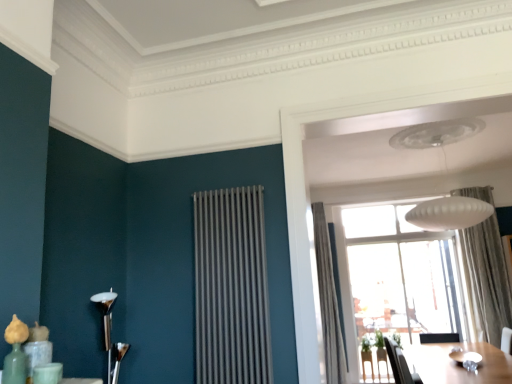
Question: Does gray textured curtain at upper right, positioned as the second curtain in right-to-left order, have a lesser height compared to white matte lampshade at upper center, acting as the 1th lamp starting from the back?

Choices:
 (A) no
 (B) yes

Answer: (A)

Question: Is gray textured curtain at upper right, positioned as the 1th curtain in left-to-right order, at the right side of white matte lampshade at upper center, the 1th lamp from the top?

Choices:
 (A) no
 (B) yes

Answer: (A)

Question: From a real-world perspective, is gray textured curtain at upper right, positioned as the second curtain in right-to-left order, on white matte lampshade at upper center, the 1th lamp from the top?

Choices:
 (A) yes
 (B) no

Answer: (B)

Question: Can you confirm if gray textured curtain at upper right, positioned as the 1th curtain in left-to-right order, is bigger than white matte lampshade at upper center, the 1th lamp from the top?

Choices:
 (A) yes
 (B) no

Answer: (B)

Question: Does gray textured curtain at upper right, positioned as the second curtain in right-to-left order, have a greater width compared to white matte lampshade at upper center, the 2th lamp in the front-to-back sequence?

Choices:
 (A) no
 (B) yes

Answer: (A)

Question: From a real-world perspective, does gray textured curtain at upper right, positioned as the second curtain in right-to-left order, sit lower than white matte lampshade at upper center, acting as the 2th lamp starting from the left?

Choices:
 (A) yes
 (B) no

Answer: (A)

Question: Is transparent glass window at center at the back of black leather swivel chair at lower right?

Choices:
 (A) yes
 (B) no

Answer: (B)

Question: From a real-world perspective, does black leather swivel chair at lower right stand above transparent glass window at center?

Choices:
 (A) no
 (B) yes

Answer: (A)

Question: Could you tell me if black leather swivel chair at lower right is facing transparent glass window at center?

Choices:
 (A) yes
 (B) no

Answer: (B)

Question: Is black leather swivel chair at lower right not close to transparent glass window at center?

Choices:
 (A) no
 (B) yes

Answer: (B)

Question: Considering the relative positions of black leather swivel chair at lower right and transparent glass window at center in the image provided, is black leather swivel chair at lower right to the right of transparent glass window at center from the viewer's perspective?

Choices:
 (A) no
 (B) yes

Answer: (A)

Question: Can you confirm if black leather swivel chair at lower right is wider than transparent glass window at center?

Choices:
 (A) no
 (B) yes

Answer: (B)

Question: Is black leather swivel chair at lower right not within wooden table at lower right?

Choices:
 (A) no
 (B) yes

Answer: (A)